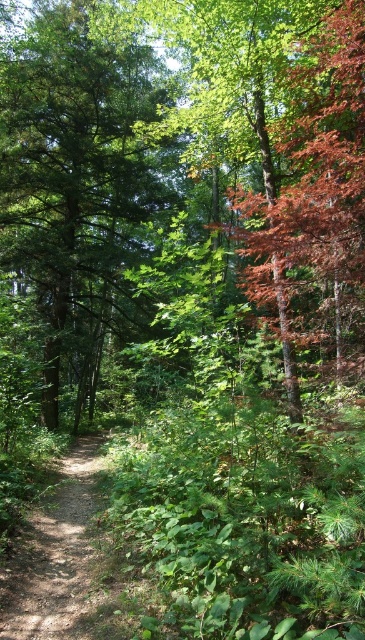
Question: Is green matte tree at center thinner than dirt path at center?

Choices:
 (A) no
 (B) yes

Answer: (A)

Question: Which point is closer to the camera?

Choices:
 (A) (79, 92)
 (B) (101, 444)

Answer: (A)

Question: Among these points, which one is farthest from the camera?

Choices:
 (A) (29, 145)
 (B) (24, 540)

Answer: (A)

Question: From the image, what is the correct spatial relationship of green matte tree at center in relation to dirt path at center?

Choices:
 (A) above
 (B) below

Answer: (A)

Question: Which point is closer to the camera?

Choices:
 (A) dirt path at center
 (B) green matte tree at center

Answer: (A)

Question: Is green matte tree at center wider than dirt path at center?

Choices:
 (A) yes
 (B) no

Answer: (A)